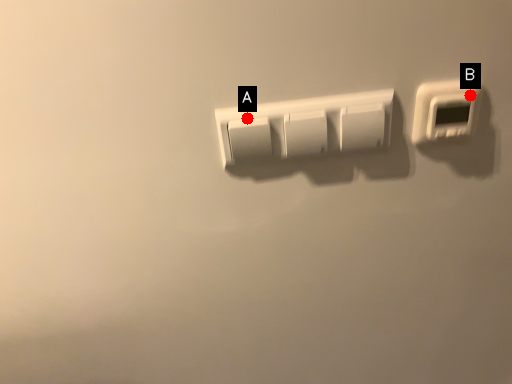
Question: Two points are circled on the image, labeled by A and B beside each circle. Which of the following is the farthest from the observer?

Choices:
 (A) A is further
 (B) B is further

Answer: (B)